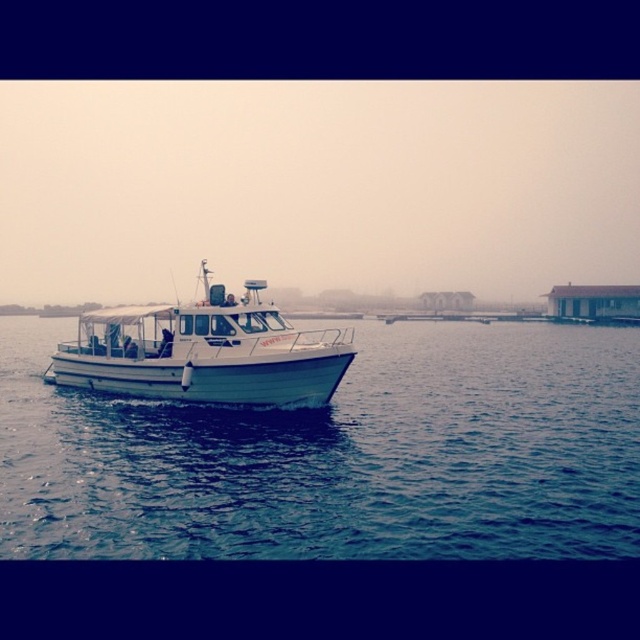
From the picture: Between blue water at center and white matte boat at center, which one has more height?

Standing taller between the two is white matte boat at center.

Between point (513, 548) and point (225, 300), which one is positioned in front?

Positioned in front is point (513, 548).

Find the location of a particular element. blue water at center is located at coordinates (339, 454).